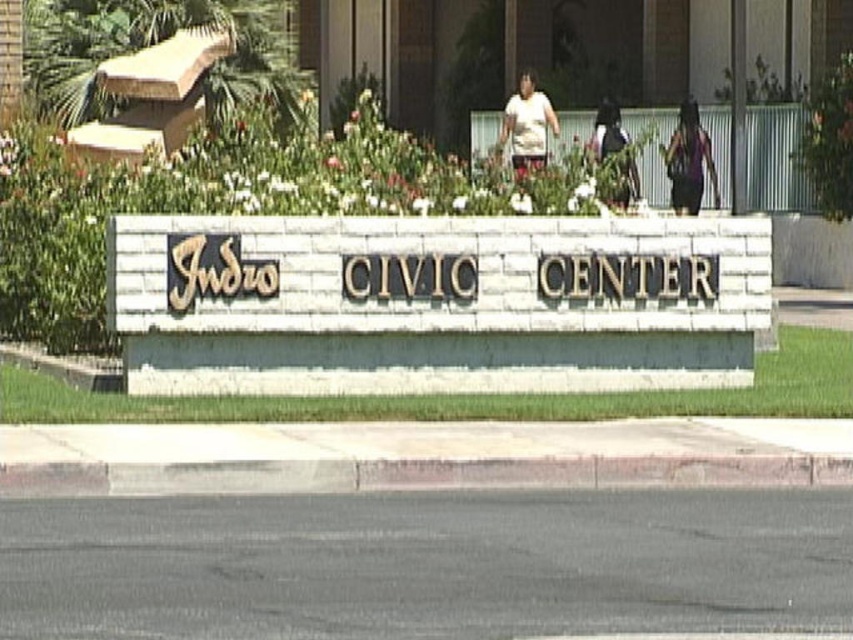
Question: Does white matte shirt at center have a larger size compared to dark fabric bag at center?

Choices:
 (A) no
 (B) yes

Answer: (B)

Question: Which point is farther to the camera?

Choices:
 (A) (700, 195)
 (B) (548, 129)
 (C) (619, 138)

Answer: (B)

Question: Among these objects, which one is farthest from the camera?

Choices:
 (A) dark fabric bag at center
 (B) dark purple fabric dress at upper right

Answer: (B)

Question: Can you confirm if dark purple fabric dress at upper right is positioned to the left of white matte shirt at center?

Choices:
 (A) no
 (B) yes

Answer: (A)

Question: Where is white matte shirt at center located in relation to dark fabric bag at center in the image?

Choices:
 (A) right
 (B) left

Answer: (B)

Question: Which is nearer to the dark purple fabric dress at upper right?

Choices:
 (A) dark fabric bag at center
 (B) white matte shirt at center

Answer: (A)